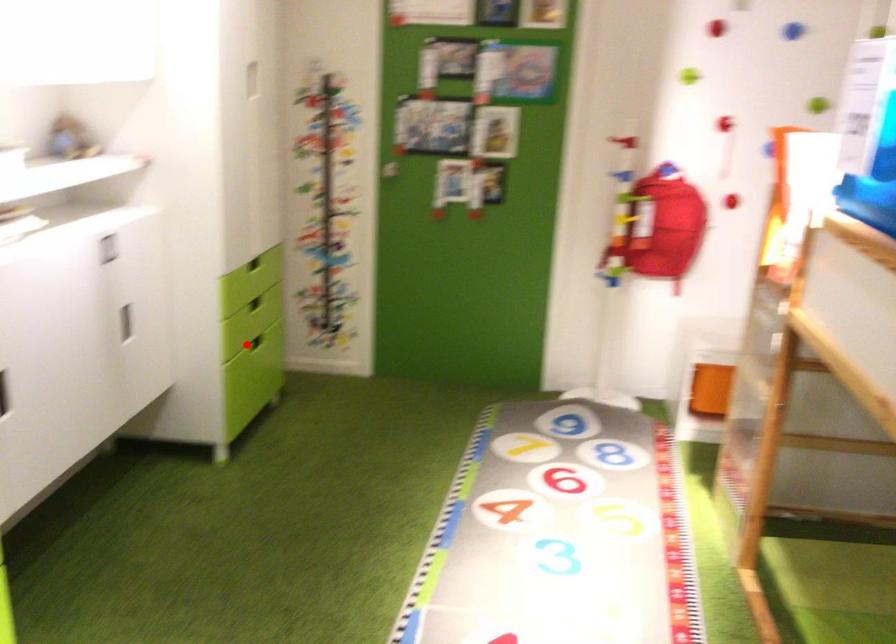
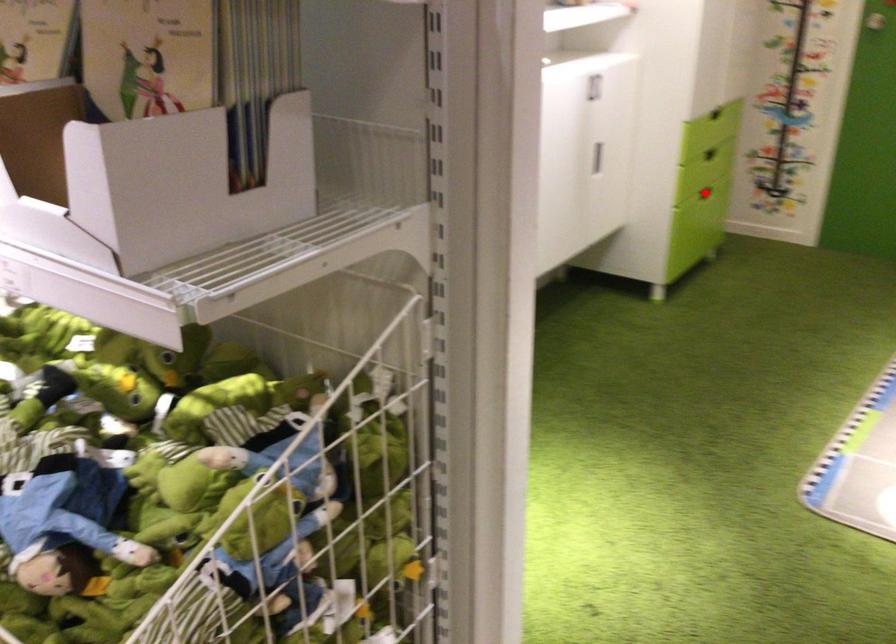
I am providing you with two images of the same scene from different viewpoints. A red point is marked on the first image and another point is marked on the second image. Do the highlighted points in image1 and image2 indicate the same real-world spot?

Yes